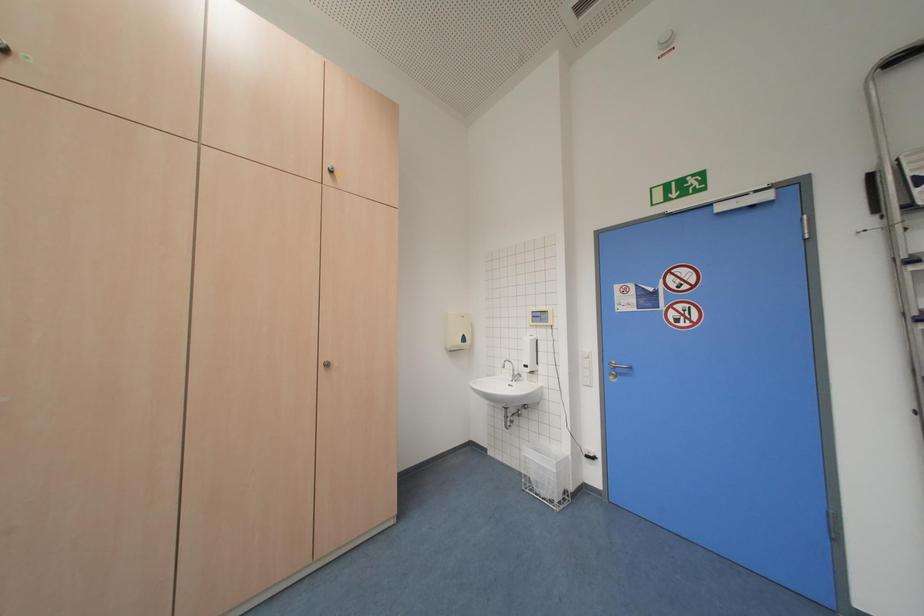
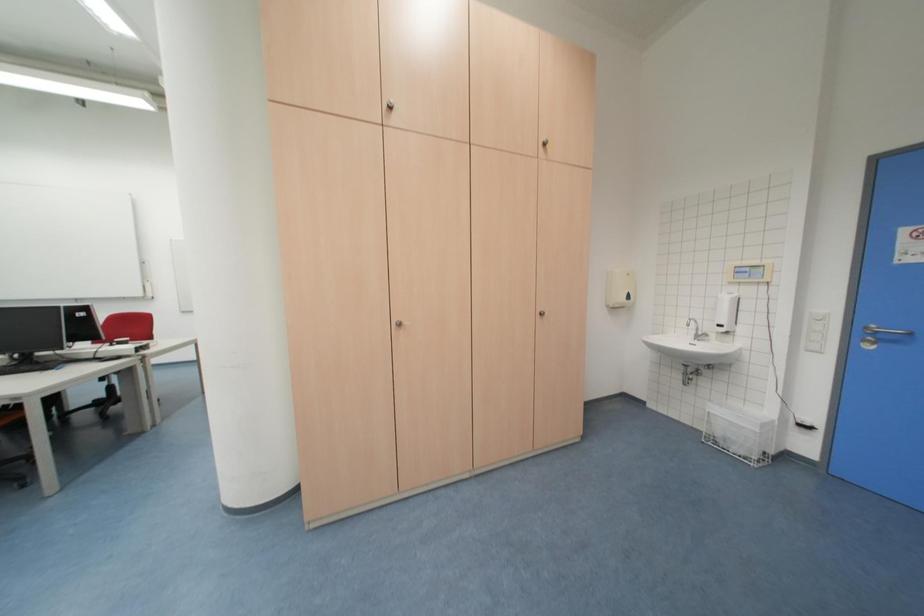
Which direction would the cameraman need to move to produce the second image?

The cameraman walked toward left, backward.